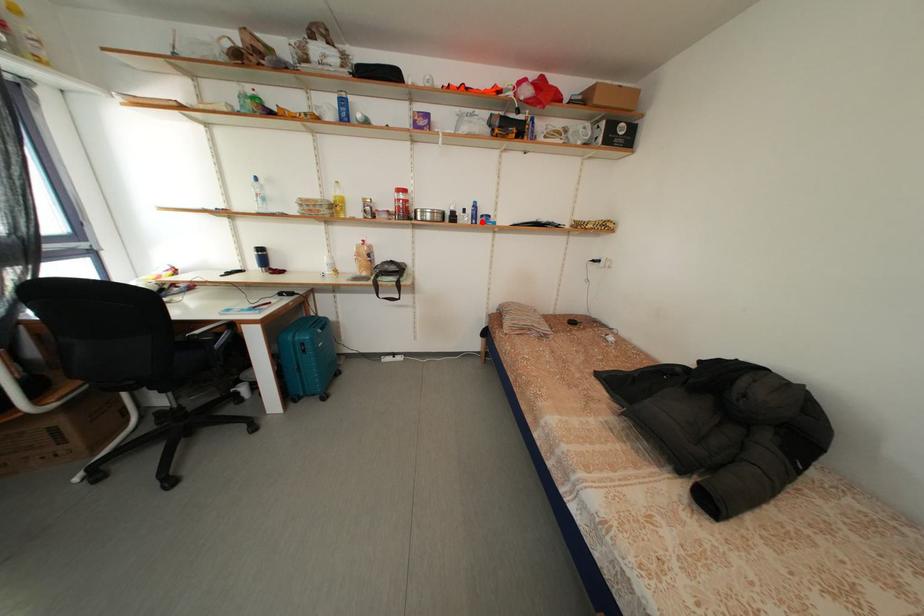
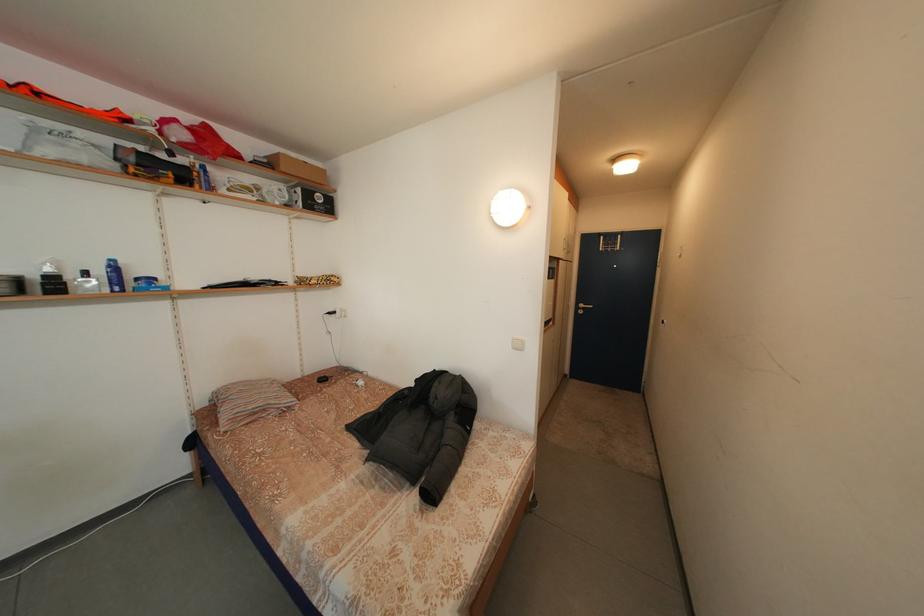
Question: I am providing you with two images of the same scene from different viewpoints. A red point is shown in image1. For the corresponding object point in image2, is it positioned nearer or farther from the camera?

Choices:
 (A) Nearer
 (B) Farther

Answer: (B)